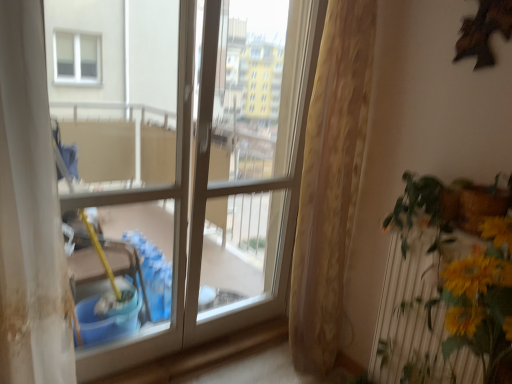
Question: Should I look upward or downward to see beige textured curtain at center?

Choices:
 (A) down
 (B) up

Answer: (A)

Question: Is white glossy screen door at center touching clear glass window at center?

Choices:
 (A) no
 (B) yes

Answer: (B)

Question: Is white glossy screen door at center wider than clear glass window at center?

Choices:
 (A) no
 (B) yes

Answer: (B)

Question: Can you confirm if white glossy screen door at center is shorter than clear glass window at center?

Choices:
 (A) no
 (B) yes

Answer: (A)

Question: From the image's perspective, is white glossy screen door at center below clear glass window at center?

Choices:
 (A) no
 (B) yes

Answer: (A)

Question: Is white glossy screen door at center bigger than clear glass window at center?

Choices:
 (A) yes
 (B) no

Answer: (A)

Question: Could you tell me if white glossy screen door at center is turned towards clear glass window at center?

Choices:
 (A) no
 (B) yes

Answer: (A)

Question: Is beige textured curtain at center next to yellow artificial flowers at right?

Choices:
 (A) no
 (B) yes

Answer: (A)

Question: Does beige textured curtain at center have a greater width compared to yellow artificial flowers at right?

Choices:
 (A) yes
 (B) no

Answer: (A)

Question: Does beige textured curtain at center have a greater height compared to yellow artificial flowers at right?

Choices:
 (A) no
 (B) yes

Answer: (B)

Question: From a real-world perspective, is beige textured curtain at center on yellow artificial flowers at right?

Choices:
 (A) yes
 (B) no

Answer: (A)

Question: Does beige textured curtain at center come behind yellow artificial flowers at right?

Choices:
 (A) yes
 (B) no

Answer: (A)

Question: Does beige textured curtain at center come in front of yellow artificial flowers at right?

Choices:
 (A) no
 (B) yes

Answer: (A)

Question: Is clear glass window at center aimed at yellow artificial flowers at right?

Choices:
 (A) yes
 (B) no

Answer: (B)